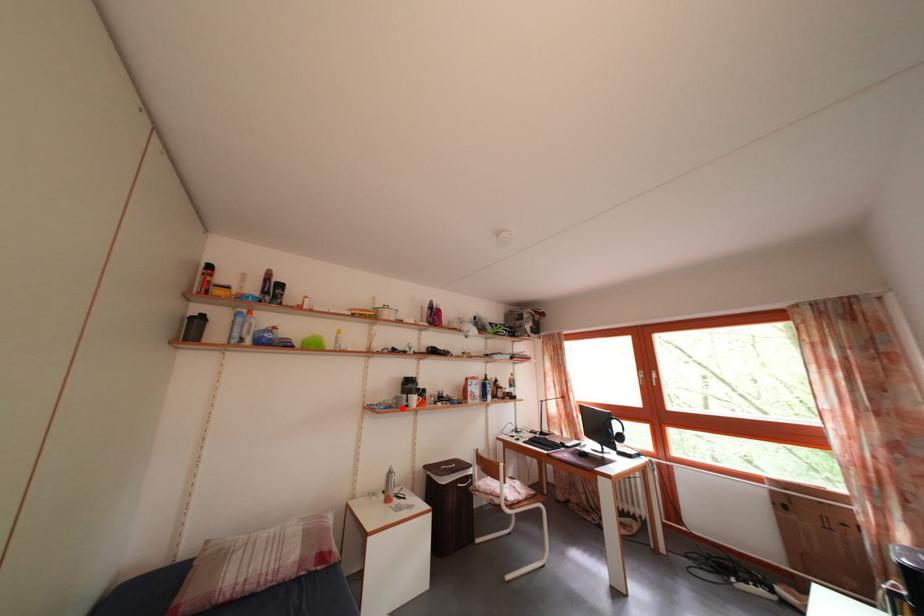
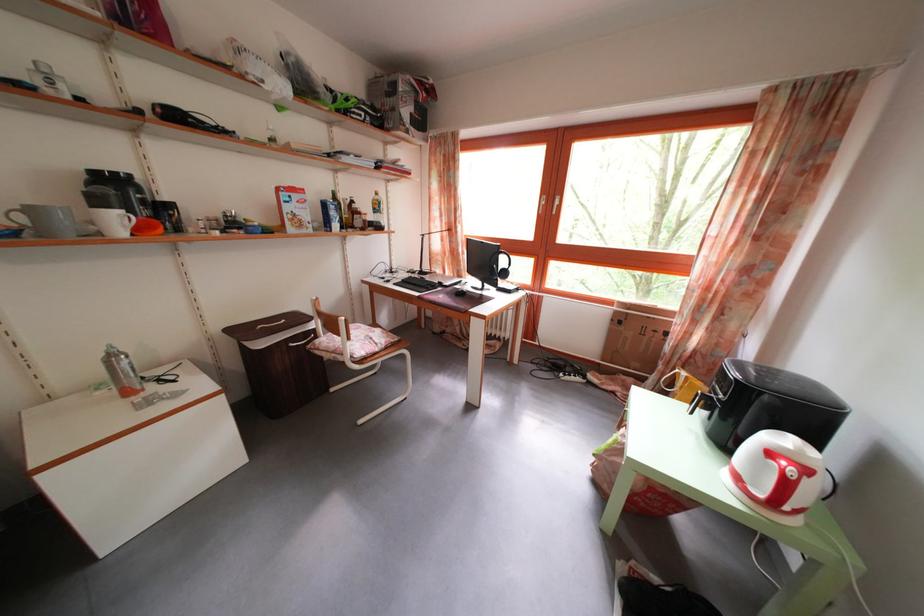
The point at the highlighted location is marked in the first image. Where is the corresponding point in the second image?

(30, 225)